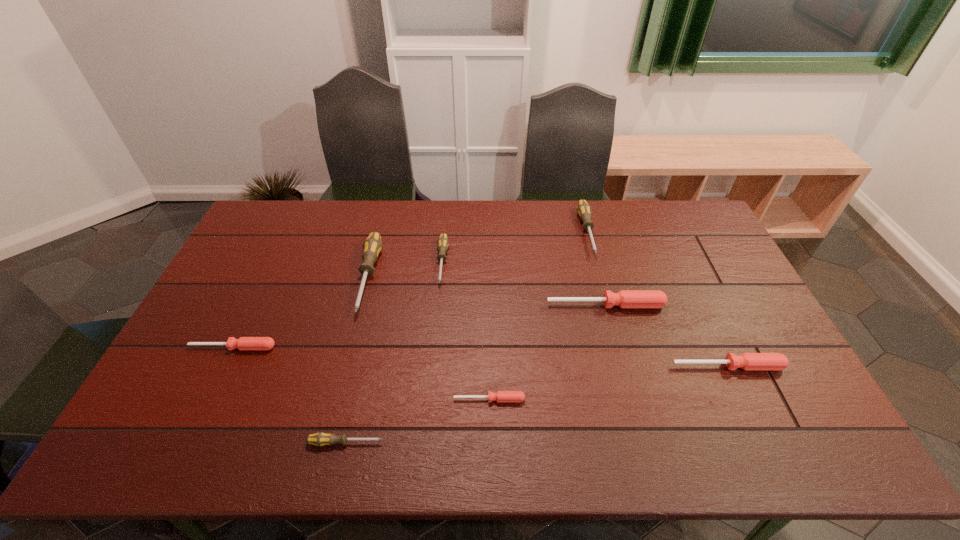
Image resolution: width=960 pixels, height=540 pixels. Identify the location of the nearest gray screwdriver. (319, 439).

Where is `the nearest object`? This screenshot has height=540, width=960. the nearest object is located at coordinates (319, 439).

Locate an element on the screen. The width and height of the screenshot is (960, 540). the smallest red screwdriver is located at coordinates (500, 396).

Find the location of a particular element. Image resolution: width=960 pixels, height=540 pixels. the nearest red screwdriver is located at coordinates 500,396.

Identify the location of vacant point located at the tip of the biggest gray screwdriver. (324, 452).

The height and width of the screenshot is (540, 960). In order to click on free space located at the tip of the second biggest gray screwdriver in this screenshot , I will do `click(612, 327)`.

Locate an element on the screen. vacant space located on the back of the biggest red screwdriver is located at coordinates (593, 260).

You are a GUI agent. You are given a task and a screenshot of the screen. Output one action in this format:
    pyautogui.click(x=<x>, y=<y>)
    Task: Click on the blank space located at the tip of the fourth object from left to right
    
    Given the screenshot: What is the action you would take?
    pyautogui.click(x=432, y=378)

At what (x,y) coordinates should I click in order to perform the action: click on free space located 0.240m on the left of the third nearest screwdriver. Please return your answer as a coordinate pair (x, y). The width and height of the screenshot is (960, 540). Looking at the image, I should click on (584, 366).

Locate an element on the screen. blank space located on the front of the fourth nearest screwdriver is located at coordinates (207, 401).